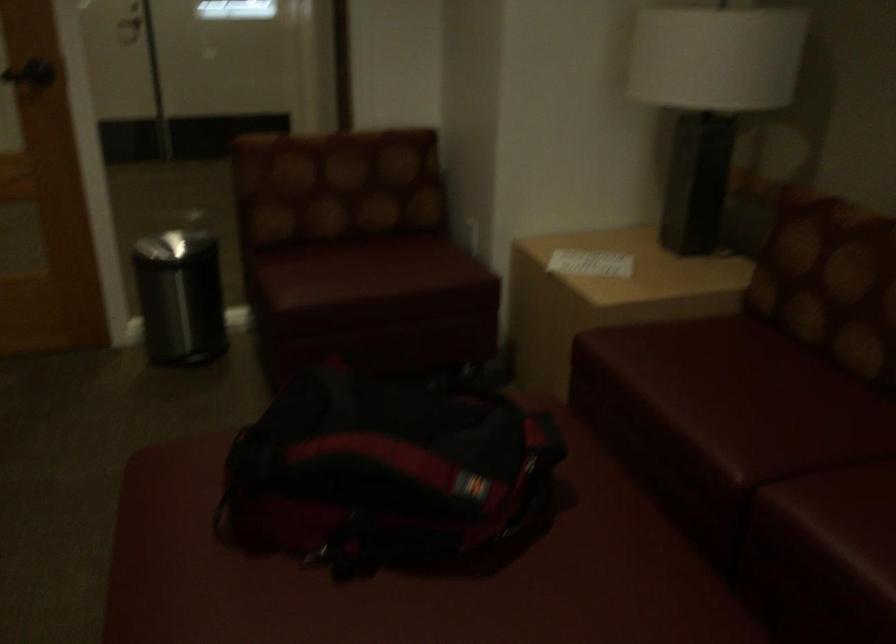
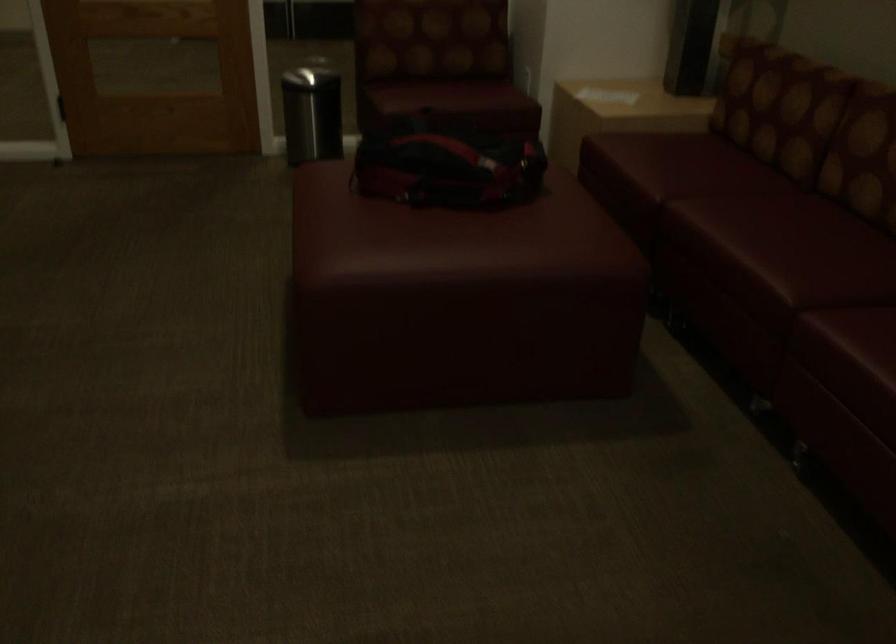
Locate, in the second image, the point that corresponds to pixel 375 283 in the first image.

(448, 96)